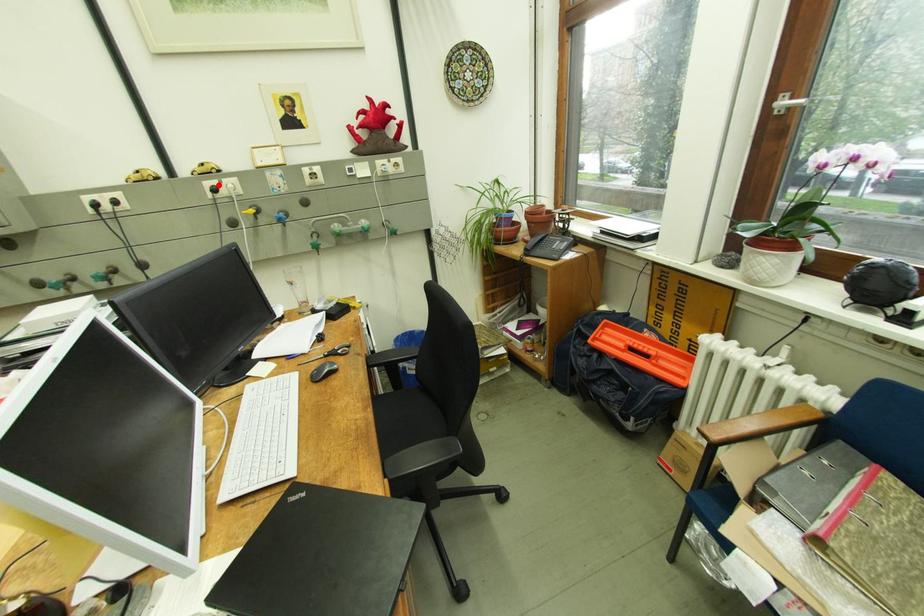
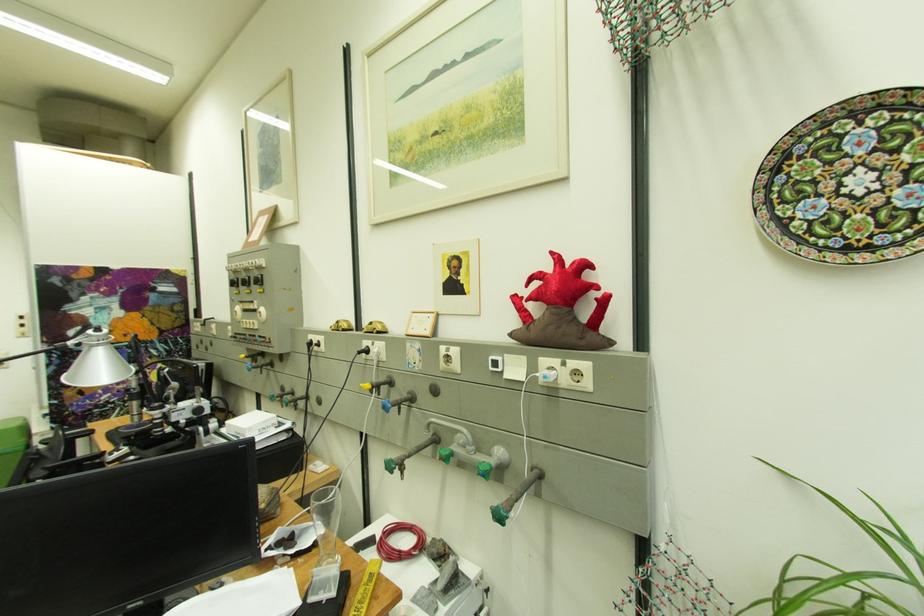
In the second image, find the point that corresponds to the highlighted location in the first image.

(375, 344)